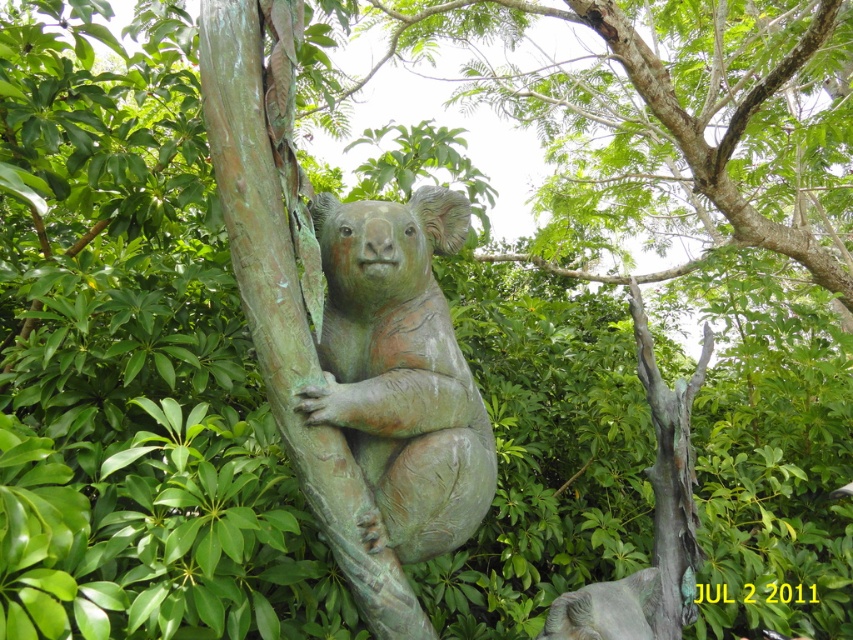
You are a park visitor standing in front of the green patina bronze koala at center and the green patina tree at center. Which object is positioned higher in the scene?

The green patina bronze koala at center is located above the green patina tree at center, so it is positioned higher in the scene.

You are a sculptor who wants to create a new statue that is exactly the same size as the green patina tree at center. You have a block of marble that is the same size as the green patina bear at center. Do you have enough marble to carve the new statue?

The green patina bear at center is narrower than the green patina tree at center. Since the marble block matches the bear in size, it is not large enough to create a statue as big as the tree. You need a bigger block of marble.